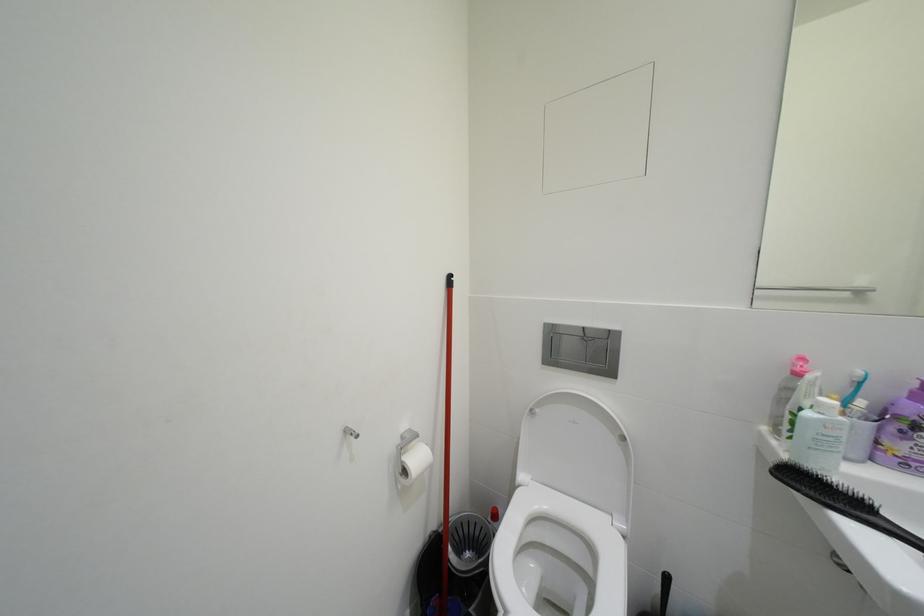
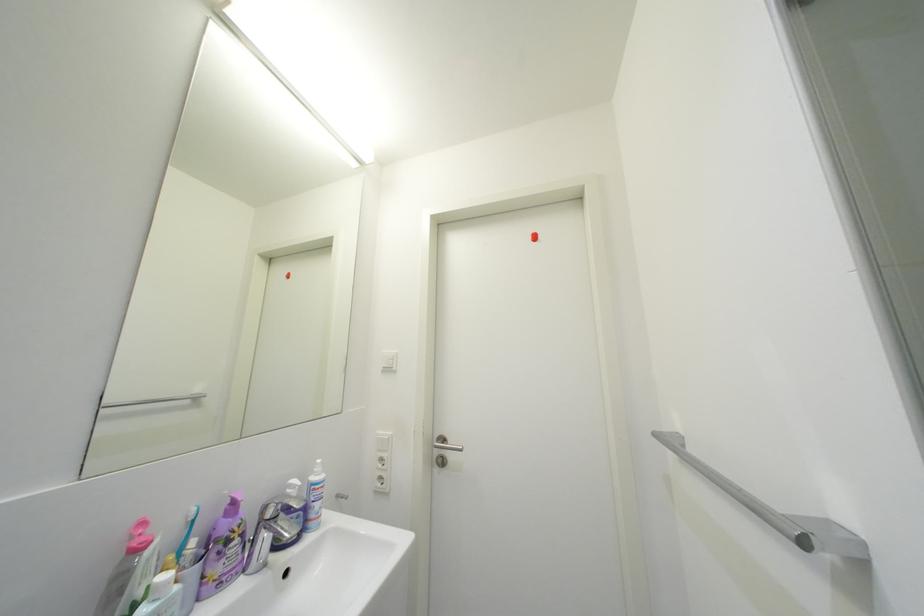
Question: The camera is either moving clockwise (left) or counter-clockwise (right) around the object. The first image is from the beginning of the video and the second image is from the end. Is the camera moving left or right when shooting the video?

Choices:
 (A) Left
 (B) Right

Answer: (A)